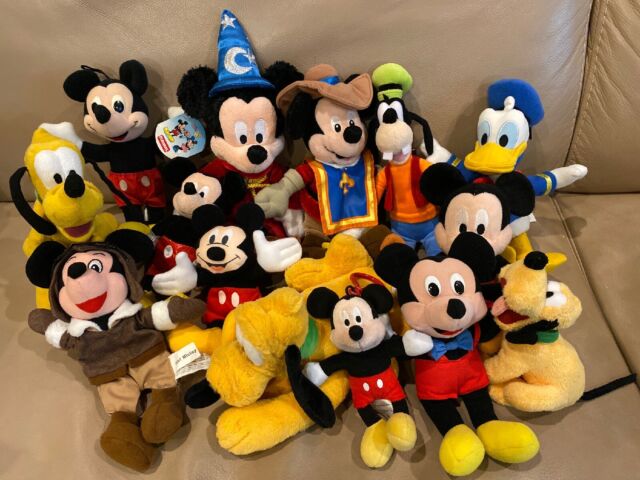
The width and height of the screenshot is (640, 480). Find the location of `plushies in the back row`. plushies in the back row is located at coordinates (x=121, y=151), (x=244, y=145), (x=336, y=151), (x=397, y=155), (x=490, y=155).